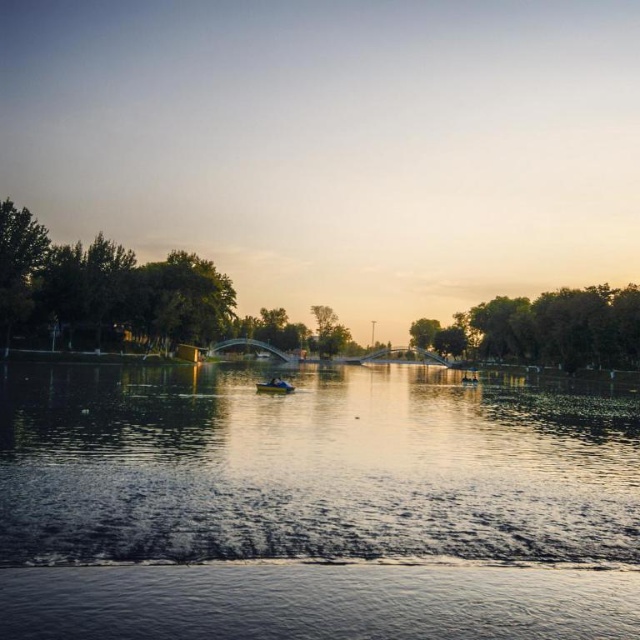
Question: Which point is farther from the camera taking this photo?

Choices:
 (A) (161, 312)
 (B) (433, 332)
 (C) (42, 243)
 (D) (244, 477)

Answer: (B)

Question: Does reflective water surface at center appear over green leafy tree at center?

Choices:
 (A) yes
 (B) no

Answer: (B)

Question: Which object is closer to the camera taking this photo?

Choices:
 (A) reflective water surface at center
 (B) green leafy trees at right

Answer: (A)

Question: Does reflective water surface at center appear over green leafy tree at center?

Choices:
 (A) yes
 (B) no

Answer: (B)

Question: Can you confirm if green leafy trees at right is smaller than green leafy tree at left?

Choices:
 (A) yes
 (B) no

Answer: (B)

Question: Estimate the real-world distances between objects in this image. Which object is closer to the green leafy tree at left?

Choices:
 (A) metallic blue boat at center
 (B) green leafy trees at right

Answer: (A)